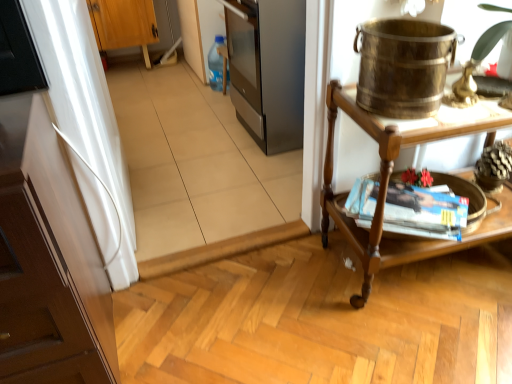
The width and height of the screenshot is (512, 384). What are the coordinates of `free region on the left part of wooden table at right` in the screenshot? It's located at (284, 306).